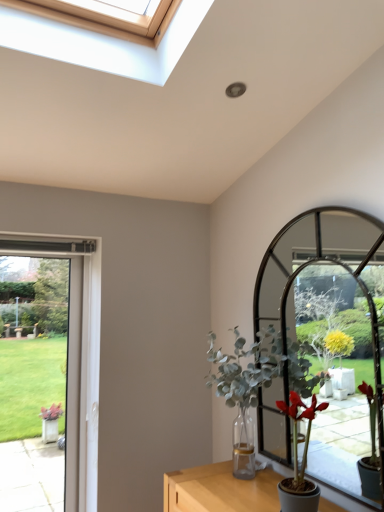
Question: Is clear glass door at left inside green leafy plant at center, the second houseplant when ordered from front to back?

Choices:
 (A) yes
 (B) no

Answer: (B)

Question: Is green leafy plant at center, the second houseplant when ordered from front to back, thinner than clear glass door at left?

Choices:
 (A) yes
 (B) no

Answer: (B)

Question: From the image's perspective, is green leafy plant at center, the second houseplant when ordered from front to back, under clear glass door at left?

Choices:
 (A) yes
 (B) no

Answer: (B)

Question: Is clear glass door at left at the back of green leafy plant at center, the 1th houseplant viewed from the back?

Choices:
 (A) yes
 (B) no

Answer: (B)

Question: Can we say green leafy plant at center, the 1th houseplant viewed from the back, lies outside clear glass door at left?

Choices:
 (A) yes
 (B) no

Answer: (A)

Question: Is green leafy plant at center, the second houseplant when ordered from front to back, wider than clear glass door at left?

Choices:
 (A) yes
 (B) no

Answer: (A)

Question: Is matte green plant at right, placed as the first houseplant when sorted from front to back, not near green leafy plant at center, the 1th houseplant viewed from the back?

Choices:
 (A) yes
 (B) no

Answer: (B)

Question: Does matte green plant at right, placed as the first houseplant when sorted from front to back, have a larger size compared to green leafy plant at center, the second houseplant when ordered from front to back?

Choices:
 (A) yes
 (B) no

Answer: (B)

Question: Is matte green plant at right, the 2th houseplant when ordered from back to front, located outside green leafy plant at center, the 1th houseplant viewed from the back?

Choices:
 (A) no
 (B) yes

Answer: (B)

Question: Considering the relative sizes of matte green plant at right, the 2th houseplant when ordered from back to front, and green leafy plant at center, the second houseplant when ordered from front to back, in the image provided, is matte green plant at right, the 2th houseplant when ordered from back to front, taller than green leafy plant at center, the second houseplant when ordered from front to back,?

Choices:
 (A) yes
 (B) no

Answer: (B)

Question: Considering the relative sizes of matte green plant at right, placed as the first houseplant when sorted from front to back, and green leafy plant at center, the second houseplant when ordered from front to back, in the image provided, is matte green plant at right, placed as the first houseplant when sorted from front to back, shorter than green leafy plant at center, the second houseplant when ordered from front to back,?

Choices:
 (A) no
 (B) yes

Answer: (B)

Question: Is matte green plant at right, placed as the first houseplant when sorted from front to back, to the left of green leafy plant at center, the 1th houseplant viewed from the back, from the viewer's perspective?

Choices:
 (A) yes
 (B) no

Answer: (B)

Question: Is clear glass door at left facing away from matte green plant at right, placed as the first houseplant when sorted from front to back?

Choices:
 (A) yes
 (B) no

Answer: (B)